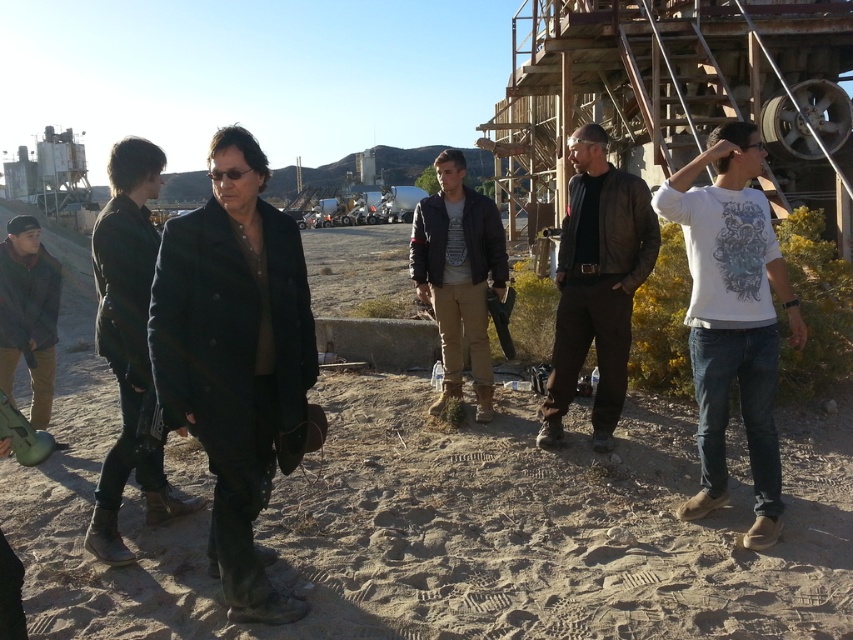
You are a photographer trying to capture a group photo of the dark matte coat at center and the leather jacket at center. You need to ensure both are fully visible in the frame. Given their sizes, which one might require more space in the photo to avoid being cut off?

The dark matte coat at center has a larger width than the leather jacket at center, so it would require more space in the photo to avoid being cut off.

You are standing in the desert and want to hand a map to the person wearing the dark matte coat at center. If you are currently 3 meters away from them, can you reach them without moving closer?

The dark matte coat at center and viewer are 2.98 meters apart from each other. Since you are only 3 meters away, you can just barely reach them without moving closer.

You are planning to set up a small tent for a desert camping trip. You have a tent that requires a space of 2 square meters. Based on the dirt field at center and the dark brown leather jacket at lower left, which area would be suitable for setting up the tent?

The dirt field at center is bigger than the dark brown leather jacket at lower left, so the dirt field at center would be suitable for setting up the tent as it provides enough space.